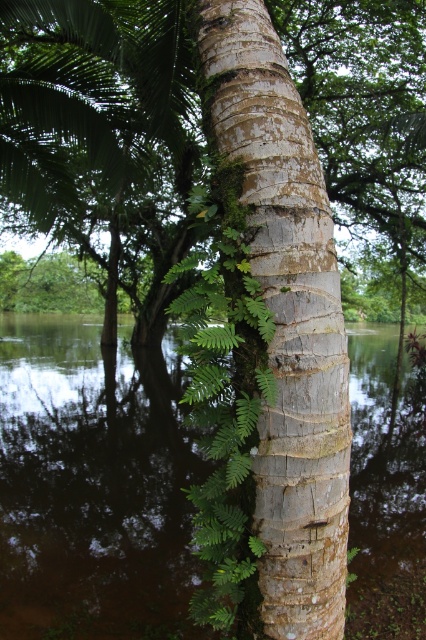
You are standing in front of the tree trunk and want to place a small birdhouse on the smooth bark tree trunk at center. To avoid blocking the green leafy fern at center, should you place the birdhouse to the left or right of the fern?

The smooth bark tree trunk at center is positioned on the right side of the green leafy fern at center. To avoid blocking the fern, place the birdhouse to the right side of the fern.

You are a bird looking for a place to perch. You see the green textured bark at center and the brown reflective water at center. Which one can you land on?

The green textured bark at center is positioned over brown reflective water at center, so you can land on the green textured bark at center.

You are standing near the tree trunk and want to place a small decorative stone between the green textured bark at center and the brown reflective water at center. Based on their positions, which object should the stone be closer to?

The green textured bark at center is positioned on the right side of brown reflective water at center, so the stone should be placed closer to the brown reflective water at center to be between them.